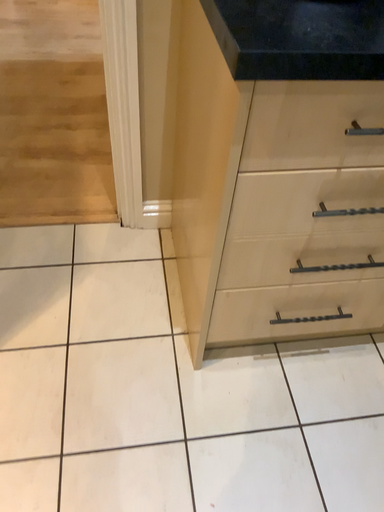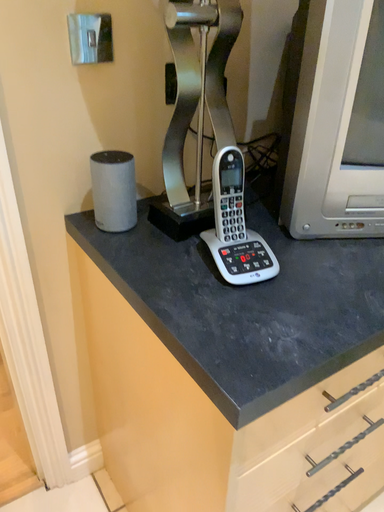
Question: Which way did the camera rotate in the video?

Choices:
 (A) rotated right
 (B) rotated left

Answer: (A)